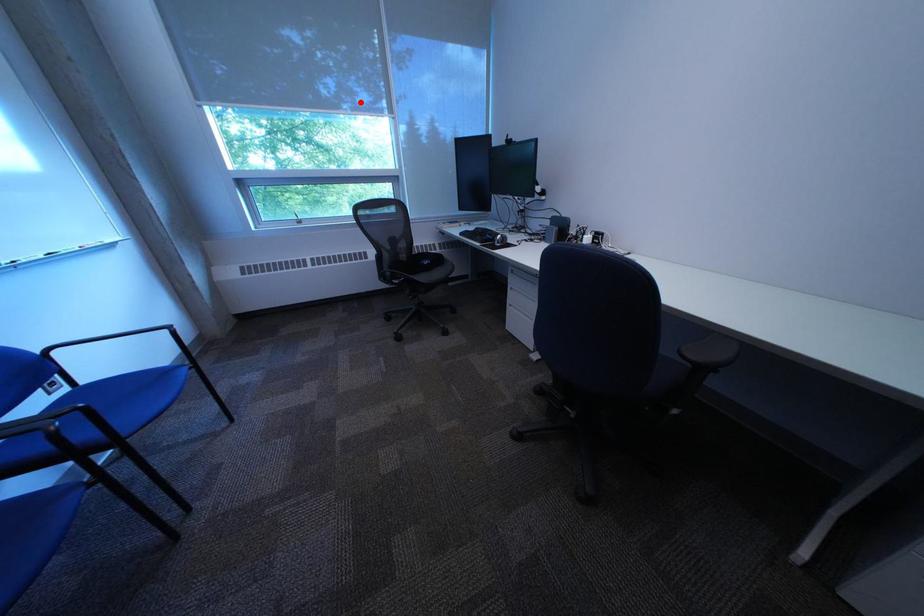
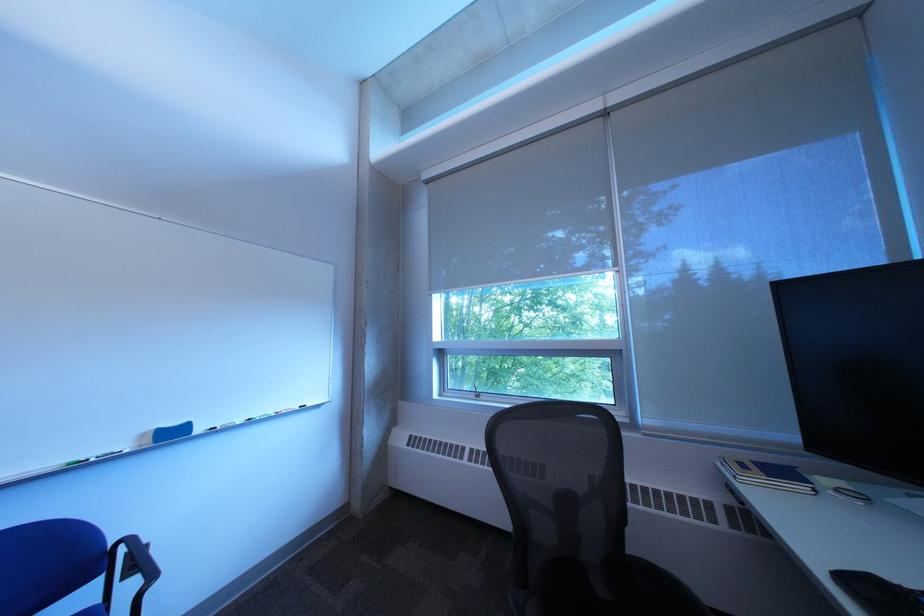
Find the pixel in the second image that matches the highlighted location in the first image.

(611, 267)